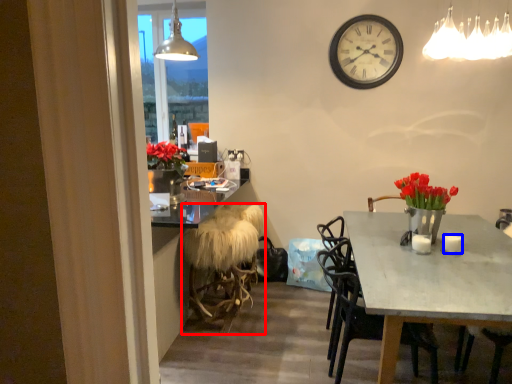
Question: Which point is further to the camera, stool (highlighted by a red box) or coffee cup (highlighted by a blue box)?

Choices:
 (A) stool
 (B) coffee cup

Answer: (A)